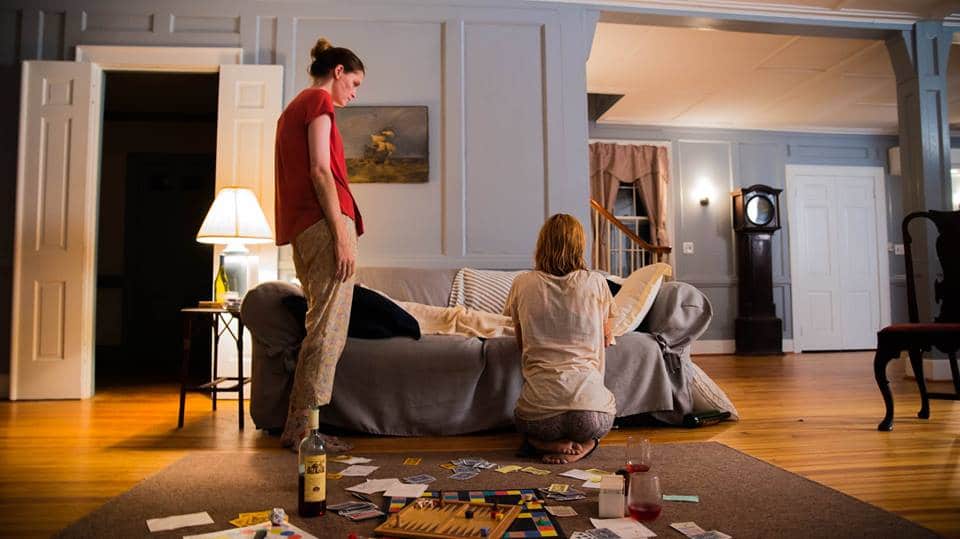
Find the location of a particular element. The height and width of the screenshot is (539, 960). couch is located at coordinates (415, 363).